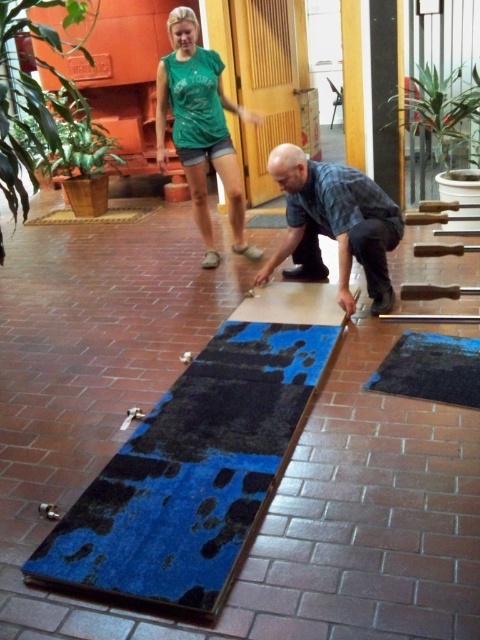
You are a worker who needs to place a heavy tool on the floor. The blue fabric at center and blue rubber mat at lower center are both available. Which surface should you choose to avoid damaging the tool?

The blue rubber mat at lower center is the better choice because it is below the blue fabric at center and likely provides a more stable and protective surface for the tool.

You are a contractor working in this room. You need to move the blue rubber mat at lower center and the green leafy plant at upper right to the other side of the room. Which object should you move first if you want to place them closer to the entrance located at the far left wall?

The blue rubber mat at lower center is already to the left of the green leafy plant at upper right, so moving the green leafy plant at upper right first would place it closer to the entrance at the far left wall.